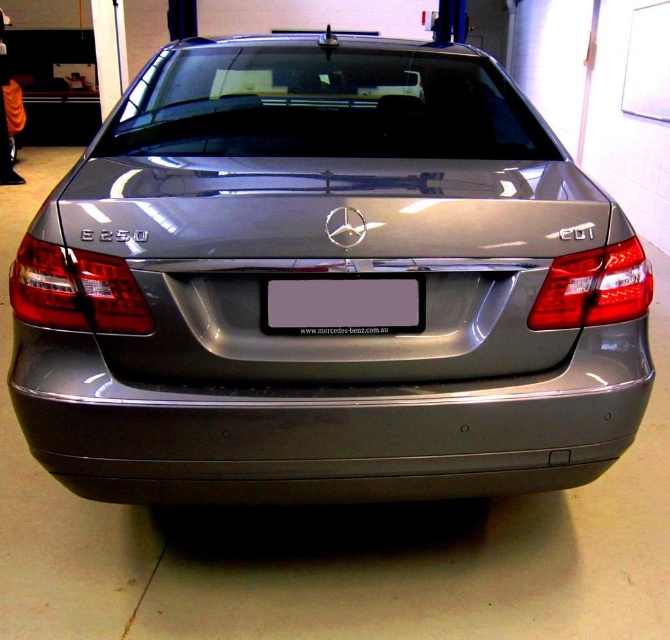
You are standing behind the Mercedes E 250 sedan in the garage. You see two points marked on the car. Which point is closer to you, the point at position (188,250) or the point at (462,467)?

Point (188,250) is in front of point (462,467), so the point at position (188,250) is closer to you.

You are standing in a garage and see the satin metallic car at center and the satin metallic bumper at center. Which one is positioned to the left?

The satin metallic car at center is to the left of the satin metallic bumper at center.